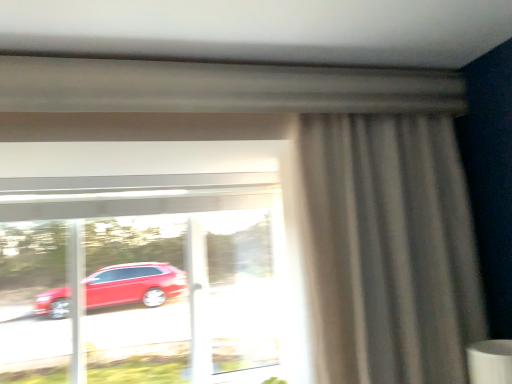
Question: Is transparent glass window at center facing away from matte gray curtain at right?

Choices:
 (A) no
 (B) yes

Answer: (A)

Question: Is transparent glass window at center closer to the viewer compared to matte gray curtain at right?

Choices:
 (A) no
 (B) yes

Answer: (A)

Question: Is matte gray curtain at right inside transparent glass window at center?

Choices:
 (A) yes
 (B) no

Answer: (B)

Question: Considering the relative sizes of transparent glass window at center and matte gray curtain at right in the image provided, is transparent glass window at center shorter than matte gray curtain at right?

Choices:
 (A) no
 (B) yes

Answer: (B)

Question: From a real-world perspective, is transparent glass window at center under matte gray curtain at right?

Choices:
 (A) no
 (B) yes

Answer: (B)

Question: Considering the relative sizes of transparent glass window at center and matte gray curtain at right in the image provided, is transparent glass window at center wider than matte gray curtain at right?

Choices:
 (A) no
 (B) yes

Answer: (A)

Question: From a real-world perspective, is matte gray curtain at right located beneath transparent glass window at center?

Choices:
 (A) yes
 (B) no

Answer: (B)

Question: Is matte gray curtain at right positioned behind transparent glass window at center?

Choices:
 (A) yes
 (B) no

Answer: (B)

Question: Can you confirm if matte gray curtain at right is wider than transparent glass window at center?

Choices:
 (A) no
 (B) yes

Answer: (B)

Question: Does matte gray curtain at right have a smaller size compared to transparent glass window at center?

Choices:
 (A) yes
 (B) no

Answer: (A)

Question: Considering the relative sizes of matte gray curtain at right and transparent glass window at center in the image provided, is matte gray curtain at right bigger than transparent glass window at center?

Choices:
 (A) yes
 (B) no

Answer: (B)

Question: Is the position of matte gray curtain at right less distant than that of transparent glass window at center?

Choices:
 (A) no
 (B) yes

Answer: (B)

Question: Considering the positions of point (326, 336) and point (28, 375), is point (326, 336) closer or farther from the camera than point (28, 375)?

Choices:
 (A) closer
 (B) farther

Answer: (A)